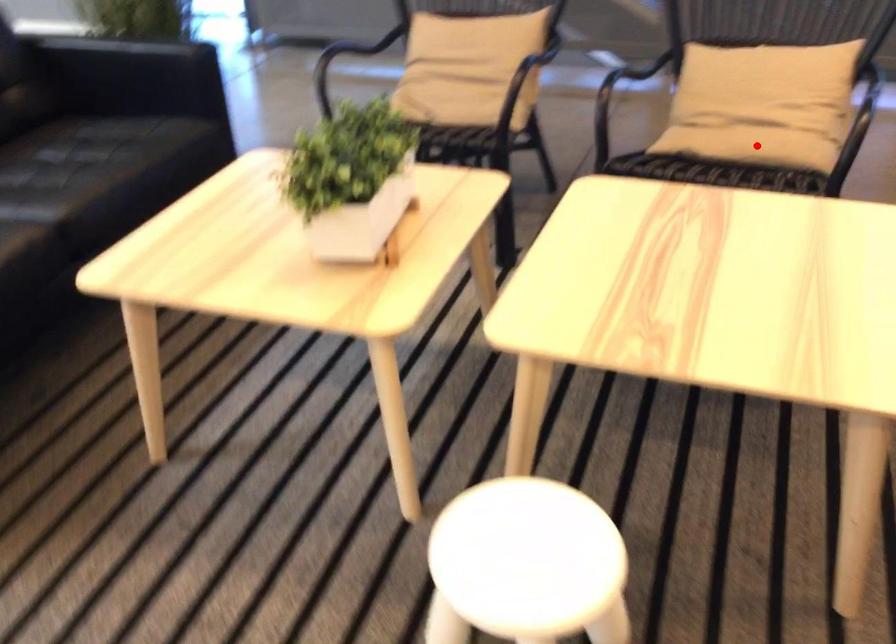
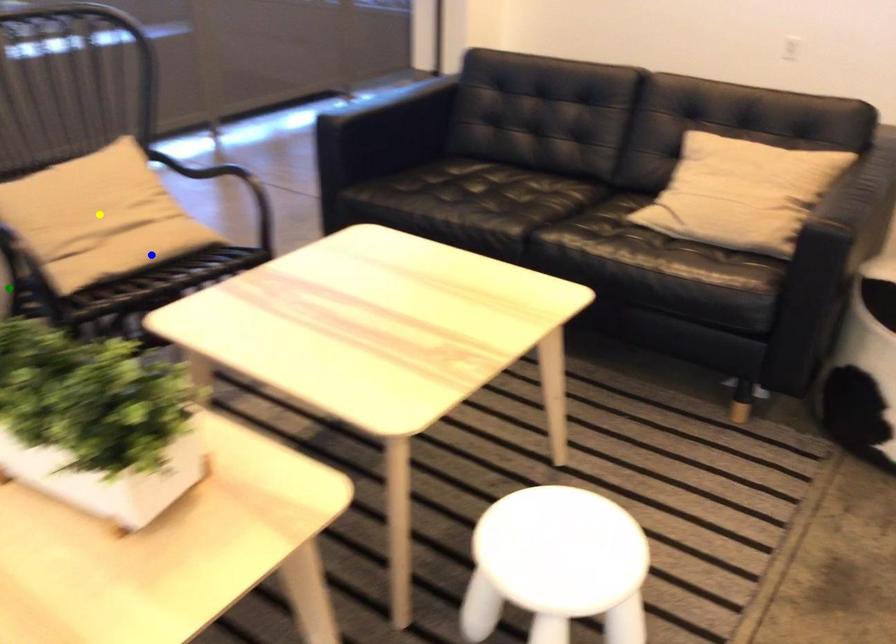
Question: I am providing you with two images of the same scene from different viewpoints. A red point is marked on the first image. You are given multiple points on the second image. In image 2, which mark is for the same physical point as the one in image 1?

Choices:
 (A) yellow point
 (B) green point
 (C) blue point

Answer: (C)